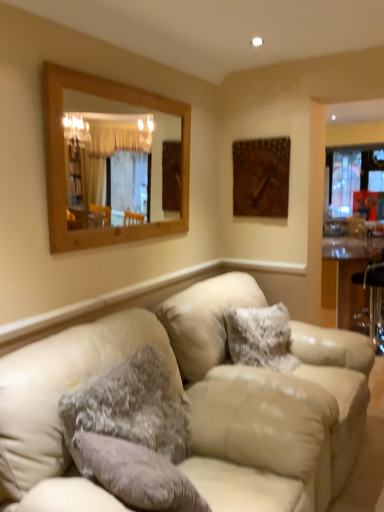
What do you see at coordinates (261, 177) in the screenshot?
I see `brown wooden picture frame at upper right` at bounding box center [261, 177].

You are a GUI agent. You are given a task and a screenshot of the screen. Output one action in this format:
    pyautogui.click(x=<x>, y=<y>)
    Task: Click on the clear glass table at right
    Image resolution: width=384 pixels, height=512 pixels.
    Given the screenshot: What is the action you would take?
    coord(346,272)

What is the approximate height of beige leather couch at center?

beige leather couch at center is 38.98 inches tall.

What is the approximate width of beige leather couch at center?

beige leather couch at center is 3.38 feet wide.

The image size is (384, 512). I want to click on brown wooden picture frame at upper right, so click(261, 177).

Is brown wooden picture frame at upper right spatially inside wooden frame mirror at upper left, or outside of it?

brown wooden picture frame at upper right is spatially situated outside wooden frame mirror at upper left.

Between point (263, 141) and point (160, 119), which one is positioned behind?

The point (160, 119) is farther from the camera.

Based on their sizes in the image, would you say brown wooden picture frame at upper right is bigger or smaller than wooden frame mirror at upper left?

Considering their sizes, brown wooden picture frame at upper right takes up less space than wooden frame mirror at upper left.

From their relative heights in the image, would you say brown wooden picture frame at upper right is taller or shorter than wooden frame mirror at upper left?

brown wooden picture frame at upper right is shorter than wooden frame mirror at upper left.

Is clear glass table at right positioned beyond the bounds of fuzzy fabric pillow at center, which is the 1th pillow from back to front?

Yes.

Between clear glass table at right and fuzzy fabric pillow at center, positioned as the second pillow in left-to-right order, which one has less height?

fuzzy fabric pillow at center, positioned as the second pillow in left-to-right order.

Considering the positions of objects clear glass table at right and fuzzy fabric pillow at center, which is the 1th pillow from back to front, in the image provided, who is in front, clear glass table at right or fuzzy fabric pillow at center, which is the 1th pillow from back to front,?

fuzzy fabric pillow at center, which is the 1th pillow from back to front, is closer to the camera.

From a real-world perspective, does fuzzy fabric pillow at center, which is the 1th pillow from back to front, sit lower than beige leather couch at center?

No.

Is the position of fuzzy fabric pillow at center, which is the 1th pillow from back to front, less distant than that of beige leather couch at center?

No, fuzzy fabric pillow at center, which is the 1th pillow from back to front, is further to the viewer.

Does fuzzy fabric pillow at center, positioned as the second pillow in left-to-right order, turn towards beige leather couch at center?

No, fuzzy fabric pillow at center, positioned as the second pillow in left-to-right order, is not aimed at beige leather couch at center.

Does fuzzy fabric pillow at center, which is the 1th pillow from right to left, have a larger size compared to beige leather couch at center?

Actually, fuzzy fabric pillow at center, which is the 1th pillow from right to left, might be smaller than beige leather couch at center.

Is brown wooden picture frame at upper right in front of or behind fuzzy gray pillow at center, the second pillow from the back, in the image?

Clearly, brown wooden picture frame at upper right is behind fuzzy gray pillow at center, the second pillow from the back.

In the scene shown: Is brown wooden picture frame at upper right completely or partially outside of fuzzy gray pillow at center, the first pillow in the left-to-right sequence?

Yes.

Is brown wooden picture frame at upper right positioned with its back to fuzzy gray pillow at center, the second pillow from the back?

No.

Can you confirm if brown wooden picture frame at upper right is shorter than fuzzy gray pillow at center, placed as the second pillow when sorted from right to left?

Incorrect, the height of brown wooden picture frame at upper right does not fall short of that of fuzzy gray pillow at center, placed as the second pillow when sorted from right to left.

Considering the relative sizes of fuzzy gray pillow at center, placed as the second pillow when sorted from right to left, and fuzzy fabric pillow at center, positioned as the second pillow in left-to-right order, in the image provided, is fuzzy gray pillow at center, placed as the second pillow when sorted from right to left, bigger than fuzzy fabric pillow at center, positioned as the second pillow in left-to-right order,?

Incorrect, fuzzy gray pillow at center, placed as the second pillow when sorted from right to left, is not larger than fuzzy fabric pillow at center, positioned as the second pillow in left-to-right order.

Considering their positions, is fuzzy gray pillow at center, the first pillow in the left-to-right sequence, located in front of or behind fuzzy fabric pillow at center, which is the 1th pillow from right to left?

Clearly, fuzzy gray pillow at center, the first pillow in the left-to-right sequence, is in front of fuzzy fabric pillow at center, which is the 1th pillow from right to left.

From the image's perspective, is fuzzy gray pillow at center, the first pillow in the left-to-right sequence, located above or below fuzzy fabric pillow at center, which is the 1th pillow from back to front?

From the image's perspective, fuzzy gray pillow at center, the first pillow in the left-to-right sequence, appears below fuzzy fabric pillow at center, which is the 1th pillow from back to front.

Is fuzzy gray pillow at center, the first pillow in the left-to-right sequence, wider than brown wooden picture frame at upper right?

Indeed, fuzzy gray pillow at center, the first pillow in the left-to-right sequence, has a greater width compared to brown wooden picture frame at upper right.

From the image's perspective, is fuzzy gray pillow at center, placed as the second pillow when sorted from right to left, located beneath brown wooden picture frame at upper right?

Correct, fuzzy gray pillow at center, placed as the second pillow when sorted from right to left, appears lower than brown wooden picture frame at upper right in the image.

Is point (125, 389) in front of point (233, 165)?

Yes.

I want to click on pillow that is the 2nd one when counting downward from the brown wooden picture frame at upper right (from the image's perspective), so click(x=128, y=408).

Looking at their sizes, would you say beige leather couch at center is wider or thinner than wooden frame mirror at upper left?

Clearly, beige leather couch at center has more width compared to wooden frame mirror at upper left.

Where is `studio couch below the wooden frame mirror at upper left (from the image's perspective)`? studio couch below the wooden frame mirror at upper left (from the image's perspective) is located at coordinates 285,426.

Can you tell me how much beige leather couch at center and wooden frame mirror at upper left differ in facing direction?

They differ by 0.00698 degrees in their facing directions.

Is beige leather couch at center positioned behind wooden frame mirror at upper left?

No.

In the image, there is a brown wooden picture frame at upper right. At what (x,y) coordinates should I click in order to perform the action: click on mirror below it (from the image's perspective). Please return your answer as a coordinate pair (x, y). This screenshot has width=384, height=512. Looking at the image, I should click on pyautogui.click(x=152, y=142).

Identify the location of table behind the fuzzy fabric pillow at center, the 2th pillow viewed from the front. The width and height of the screenshot is (384, 512). (346, 272).

From the image, which object appears to be farther from brown wooden picture frame at upper right, clear glass window at right or wooden frame mirror at upper left?

The object further to brown wooden picture frame at upper right is clear glass window at right.

Based on their spatial positions, is brown wooden picture frame at upper right or fuzzy fabric pillow at center, which is the 1th pillow from back to front, further from beige leather couch at center?

brown wooden picture frame at upper right is further to beige leather couch at center.

Considering their positions, is clear glass window at right positioned further to brown wooden picture frame at upper right than fuzzy gray pillow at center, placed as the second pillow when sorted from right to left?

clear glass window at right is positioned further to the anchor brown wooden picture frame at upper right.

Which object lies further to the anchor point clear glass window at right, clear glass table at right or beige leather couch at center?

beige leather couch at center.

Estimate the real-world distances between objects in this image. Which object is further from fuzzy gray pillow at center, the second pillow from the back, fuzzy fabric pillow at center, which is the 1th pillow from back to front, or beige leather couch at center?

fuzzy fabric pillow at center, which is the 1th pillow from back to front.

Looking at the image, which one is located further to clear glass table at right, brown wooden picture frame at upper right or beige leather couch at center?

beige leather couch at center is further to clear glass table at right.

Looking at the image, which one is located further to beige leather couch at center, clear glass table at right or brown wooden picture frame at upper right?

Among the two, clear glass table at right is located further to beige leather couch at center.

Which object lies further to the anchor point clear glass window at right, clear glass table at right or wooden frame mirror at upper left?

wooden frame mirror at upper left.

Locate an element on the screen. Image resolution: width=384 pixels, height=512 pixels. mirror between fuzzy gray pillow at center, placed as the second pillow when sorted from right to left, and clear glass table at right, along the z-axis is located at coordinates (152, 142).

Find the location of `pillow located between fuzzy gray pillow at center, which is the first pillow from front to back, and brown wooden picture frame at upper right in the depth direction`. pillow located between fuzzy gray pillow at center, which is the first pillow from front to back, and brown wooden picture frame at upper right in the depth direction is located at coordinates (261, 337).

Where is `table located between fuzzy fabric pillow at center, positioned as the second pillow in left-to-right order, and clear glass window at right in the depth direction`? This screenshot has height=512, width=384. table located between fuzzy fabric pillow at center, positioned as the second pillow in left-to-right order, and clear glass window at right in the depth direction is located at coordinates (346, 272).

The width and height of the screenshot is (384, 512). In order to click on table positioned between fuzzy gray pillow at center, the second pillow from the back, and clear glass window at right from near to far in this screenshot , I will do `click(346, 272)`.